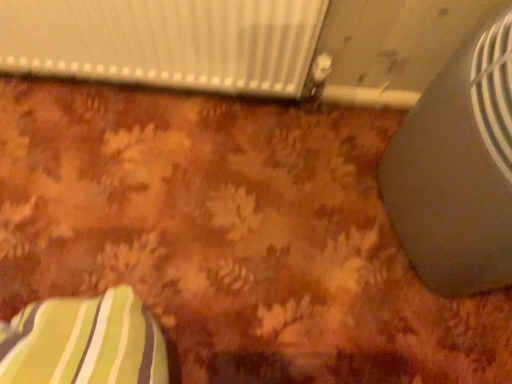
Question: Would you say satin gray fan at right is outside white textured radiator at upper center?

Choices:
 (A) no
 (B) yes

Answer: (B)

Question: Is white textured radiator at upper center at the back of satin gray fan at right?

Choices:
 (A) yes
 (B) no

Answer: (B)

Question: Is the depth of satin gray fan at right less than that of white textured radiator at upper center?

Choices:
 (A) no
 (B) yes

Answer: (B)

Question: Is satin gray fan at right surrounding white textured radiator at upper center?

Choices:
 (A) no
 (B) yes

Answer: (A)

Question: From the image's perspective, does satin gray fan at right appear lower than white textured radiator at upper center?

Choices:
 (A) no
 (B) yes

Answer: (B)

Question: From the image's perspective, is satin gray fan at right on top of white textured radiator at upper center?

Choices:
 (A) yes
 (B) no

Answer: (B)

Question: Are white textured radiator at upper center and satin gray fan at right located far from each other?

Choices:
 (A) no
 (B) yes

Answer: (A)

Question: Considering the relative sizes of white textured radiator at upper center and satin gray fan at right in the image provided, is white textured radiator at upper center bigger than satin gray fan at right?

Choices:
 (A) no
 (B) yes

Answer: (A)

Question: Is white textured radiator at upper center at the right side of satin gray fan at right?

Choices:
 (A) no
 (B) yes

Answer: (A)

Question: Is white textured radiator at upper center to the left of satin gray fan at right from the viewer's perspective?

Choices:
 (A) yes
 (B) no

Answer: (A)

Question: Does white textured radiator at upper center have a lesser width compared to satin gray fan at right?

Choices:
 (A) no
 (B) yes

Answer: (B)

Question: Is white textured radiator at upper center not within satin gray fan at right?

Choices:
 (A) no
 (B) yes

Answer: (B)

Question: From the image's perspective, relative to white textured radiator at upper center, is satin gray fan at right above or below?

Choices:
 (A) below
 (B) above

Answer: (A)